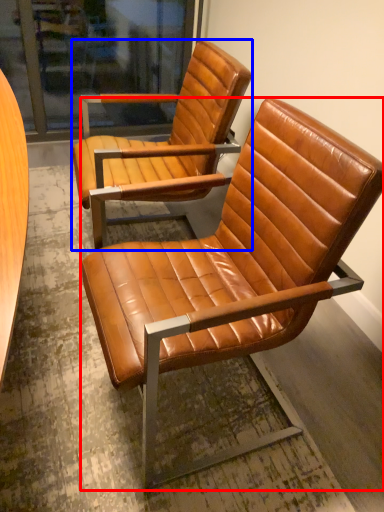
Question: Among these objects, which one is nearest to the camera, chair (highlighted by a red box) or chair (highlighted by a blue box)?

Choices:
 (A) chair
 (B) chair

Answer: (A)